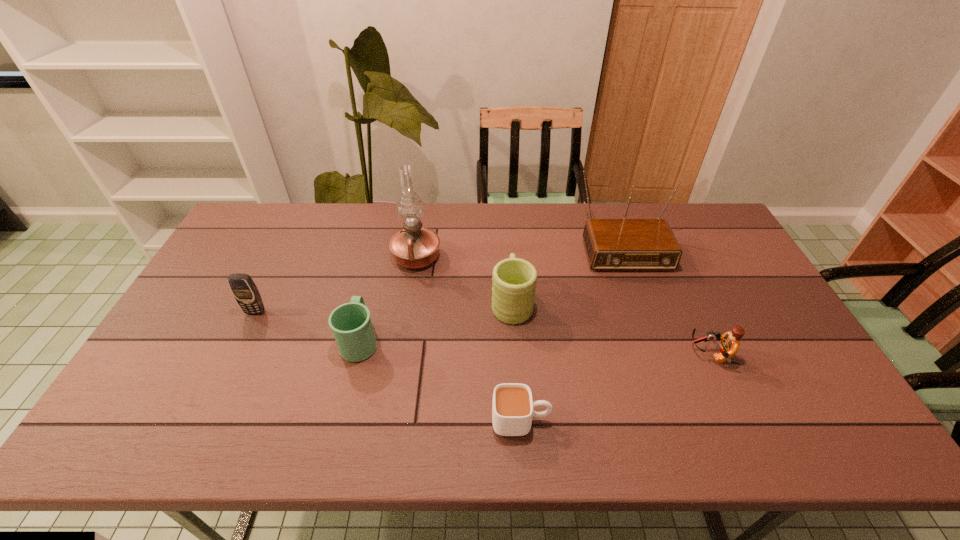
Find the location of a particular element. object that stands as the fifth closest to the cellular telephone is located at coordinates (611, 244).

You are a GUI agent. You are given a task and a screenshot of the screen. Output one action in this format:
    pyautogui.click(x=<x>, y=<y>)
    Task: Click on the free region that satisfies the following two spatial constraints: 1. on the front panel of the radio_receiver; 2. on the side with the handle of the nearest object
    
    Given the screenshot: What is the action you would take?
    pyautogui.click(x=683, y=420)